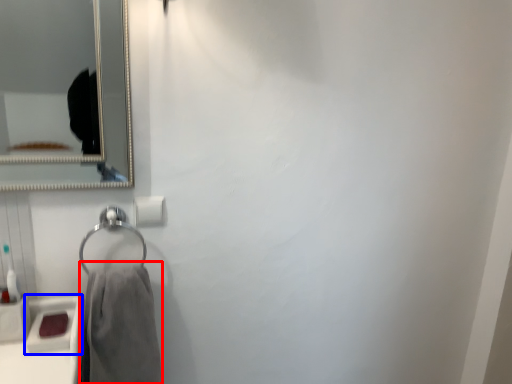
Question: Which point is further to the camera, bath towel (highlighted by a red box) or sink (highlighted by a blue box)?

Choices:
 (A) bath towel
 (B) sink

Answer: (B)